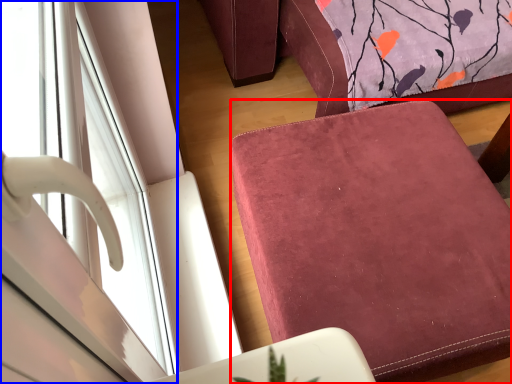
Question: Which object appears farthest to the camera in this image, furniture (highlighted by a red box) or window (highlighted by a blue box)?

Choices:
 (A) furniture
 (B) window

Answer: (A)